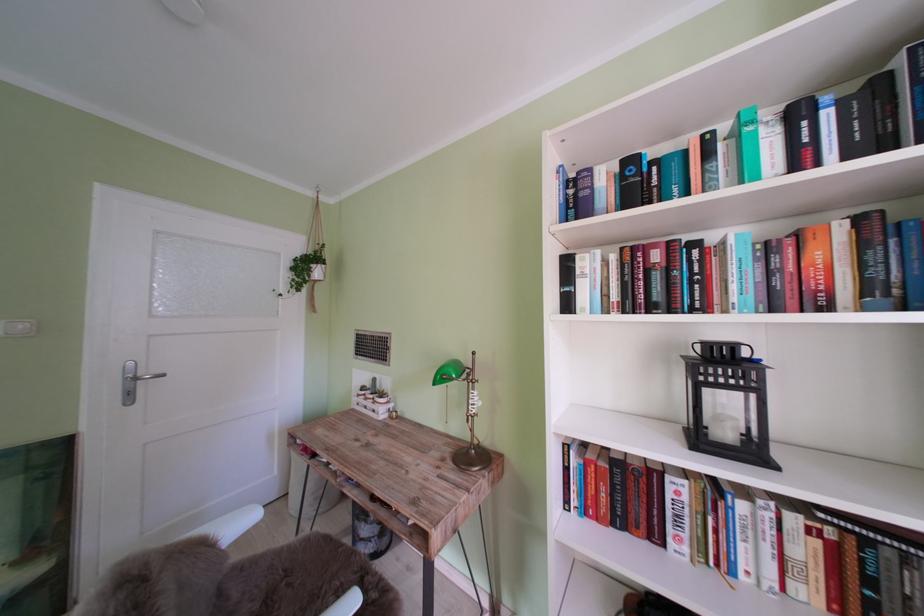
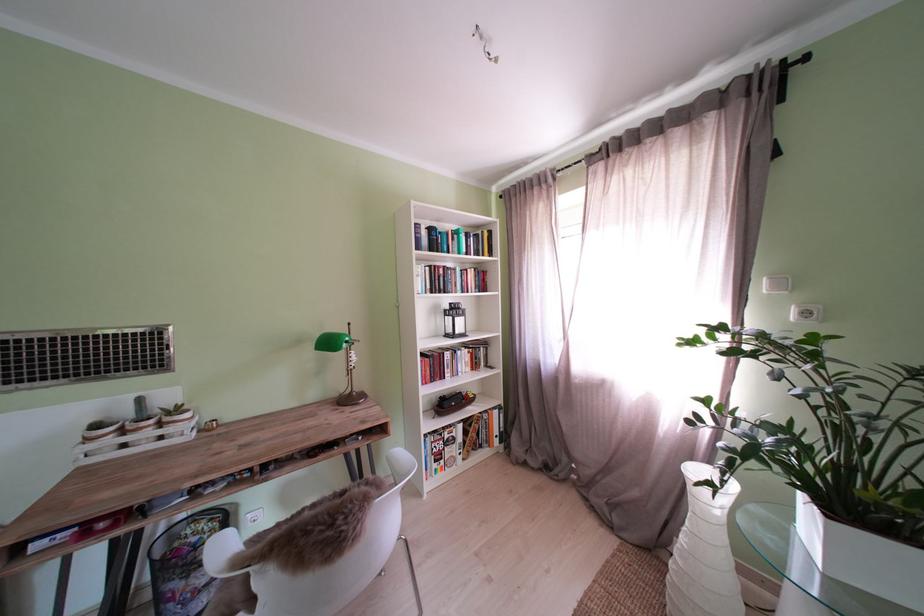
In the second image, find the point that corresponds to (x=383, y=402) in the first image.

(163, 427)